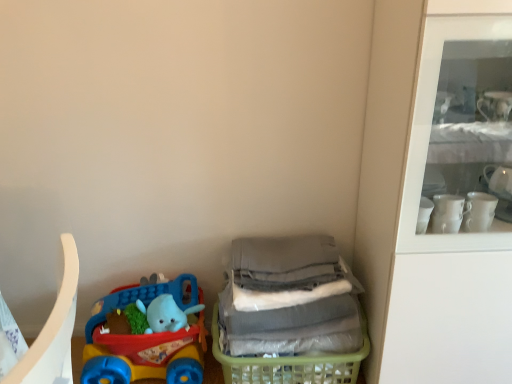
Question: Is plastic toy car at lower left outside translucent green plastic basket at lower right?

Choices:
 (A) no
 (B) yes

Answer: (B)

Question: Is plastic toy car at lower left touching translucent green plastic basket at lower right?

Choices:
 (A) no
 (B) yes

Answer: (A)

Question: Does plastic toy car at lower left have a larger size compared to translucent green plastic basket at lower right?

Choices:
 (A) yes
 (B) no

Answer: (B)

Question: Does plastic toy car at lower left have a lesser width compared to translucent green plastic basket at lower right?

Choices:
 (A) no
 (B) yes

Answer: (B)

Question: Is plastic toy car at lower left not near translucent green plastic basket at lower right?

Choices:
 (A) no
 (B) yes

Answer: (A)

Question: Is plastic toy car at lower left facing towards translucent green plastic basket at lower right?

Choices:
 (A) yes
 (B) no

Answer: (B)

Question: Can you confirm if translucent green plastic basket at lower right is taller than plastic toy car at lower left?

Choices:
 (A) no
 (B) yes

Answer: (A)

Question: Can you confirm if translucent green plastic basket at lower right is wider than plastic toy car at lower left?

Choices:
 (A) yes
 (B) no

Answer: (A)

Question: Is translucent green plastic basket at lower right not within plastic toy car at lower left?

Choices:
 (A) no
 (B) yes

Answer: (B)

Question: Is translucent green plastic basket at lower right at the right side of plastic toy car at lower left?

Choices:
 (A) yes
 (B) no

Answer: (A)

Question: From a real-world perspective, is translucent green plastic basket at lower right located beneath plastic toy car at lower left?

Choices:
 (A) yes
 (B) no

Answer: (A)

Question: Does translucent green plastic basket at lower right have a larger size compared to plastic toy car at lower left?

Choices:
 (A) yes
 (B) no

Answer: (A)

Question: Choose the correct answer: Is plastic toy car at lower left inside translucent green plastic basket at lower right or outside it?

Choices:
 (A) outside
 (B) inside

Answer: (A)